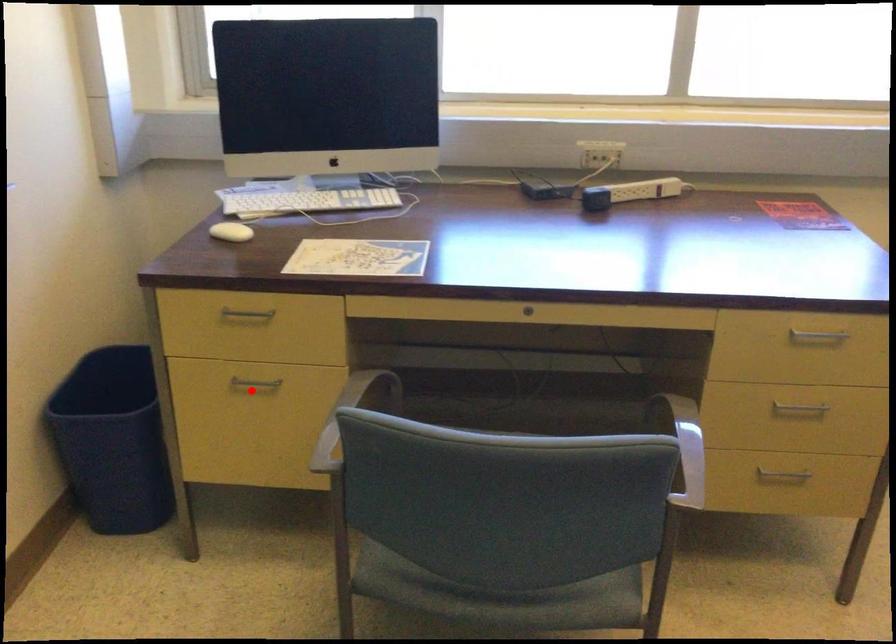
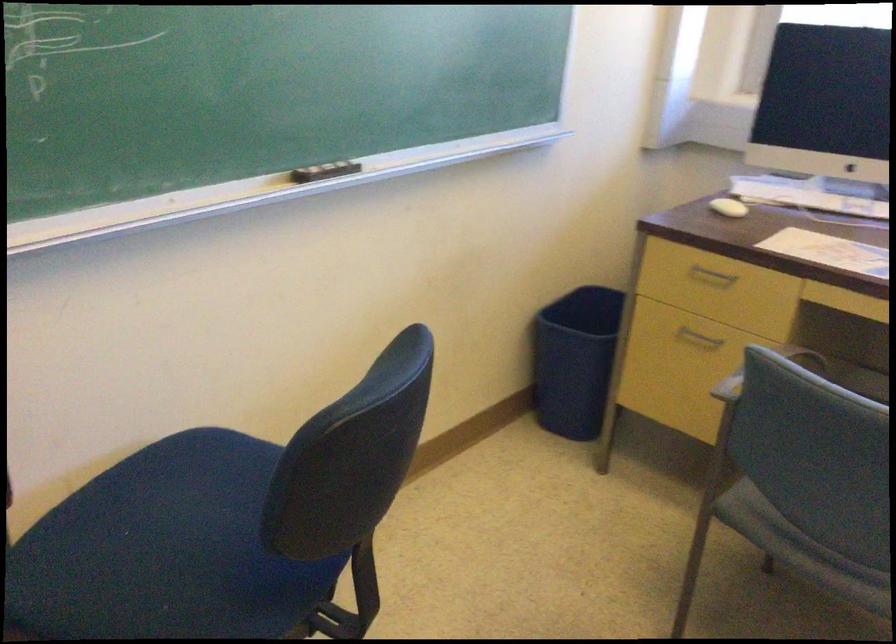
Question: A red point is marked in image1. In image2, is the corresponding 3D point closer to the camera or farther? Reply with the corresponding letter.

Choices:
 (A) The corresponding 3D point is closer.
 (B) The corresponding 3D point is farther.

Answer: (B)